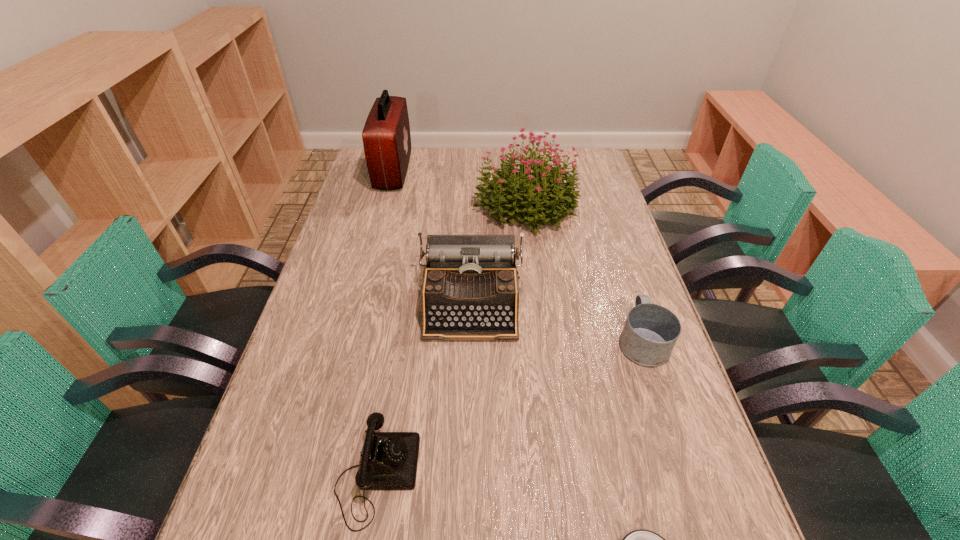
The image size is (960, 540). I want to click on free space at the left edge of the desktop, so click(349, 206).

Image resolution: width=960 pixels, height=540 pixels. In the image, there is a desktop. In order to click on free space at the right edge in this screenshot , I will do pos(654,511).

Find the location of `free region at the far left corner of the desktop`. free region at the far left corner of the desktop is located at coordinates (366, 174).

In order to click on free space at the far right corner of the desktop in this screenshot , I will do `click(602, 178)`.

Locate an element on the screen. The height and width of the screenshot is (540, 960). free space between the typewriter and the telephone is located at coordinates (424, 389).

In order to click on free spot between the mug and the telephone in this screenshot , I will do `click(510, 407)`.

Locate an element on the screen. This screenshot has width=960, height=540. free point between the mug and the telephone is located at coordinates (510, 407).

This screenshot has height=540, width=960. I want to click on object that is the third nearest to the bouquet, so click(650, 332).

Identify which object is located as the fourth nearest to the rightmost object. Please provide its 2D coordinates. Your answer should be formatted as a tuple, i.e. [(x, y)], where the tuple contains the x and y coordinates of a point satisfying the conditions above.

[(389, 461)]

You are a GUI agent. You are given a task and a screenshot of the screen. Output one action in this format:
    pyautogui.click(x=<x>, y=<y>)
    Task: Click on the vacant space that satisfies the following two spatial constraints: 1. on the side of the first aid kit with the cross symbol; 2. on the side of the mug with the handle
    
    Given the screenshot: What is the action you would take?
    pyautogui.click(x=348, y=340)